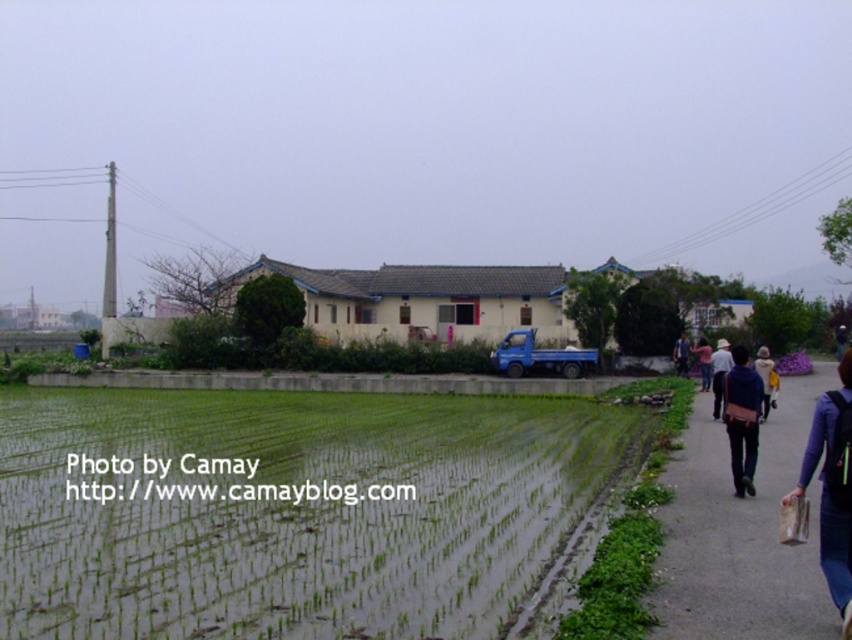
Can you confirm if blue denim jeans at lower right is taller than pink fabric at right?

Correct, blue denim jeans at lower right is much taller as pink fabric at right.

Which is more to the left, blue denim jeans at lower right or pink fabric at right?

pink fabric at right is more to the left.

Does point (841, 605) come in front of point (701, 378)?

Yes, it is.

What are the coordinates of `blue denim jeans at lower right` in the screenshot? It's located at (832, 488).

Does blue denim jeans at lower right have a lesser height compared to light blue shirt at center-right?

No.

The image size is (852, 640). What are the coordinates of `blue denim jeans at lower right` in the screenshot? It's located at (832, 488).

Who is more distant from viewer, (x=810, y=467) or (x=717, y=413)?

The point (x=717, y=413) is behind.

Find the location of a particular element. The image size is (852, 640). blue denim jeans at lower right is located at coordinates (832, 488).

This screenshot has width=852, height=640. I want to click on gray asphalt pavement at lower right, so click(741, 532).

Based on the photo, between gray asphalt pavement at lower right and pink fabric at right, which one appears on the left side from the viewer's perspective?

From the viewer's perspective, gray asphalt pavement at lower right appears more on the left side.

What do you see at coordinates (741, 532) in the screenshot? This screenshot has height=640, width=852. I see `gray asphalt pavement at lower right` at bounding box center [741, 532].

This screenshot has height=640, width=852. I want to click on gray asphalt pavement at lower right, so click(x=741, y=532).